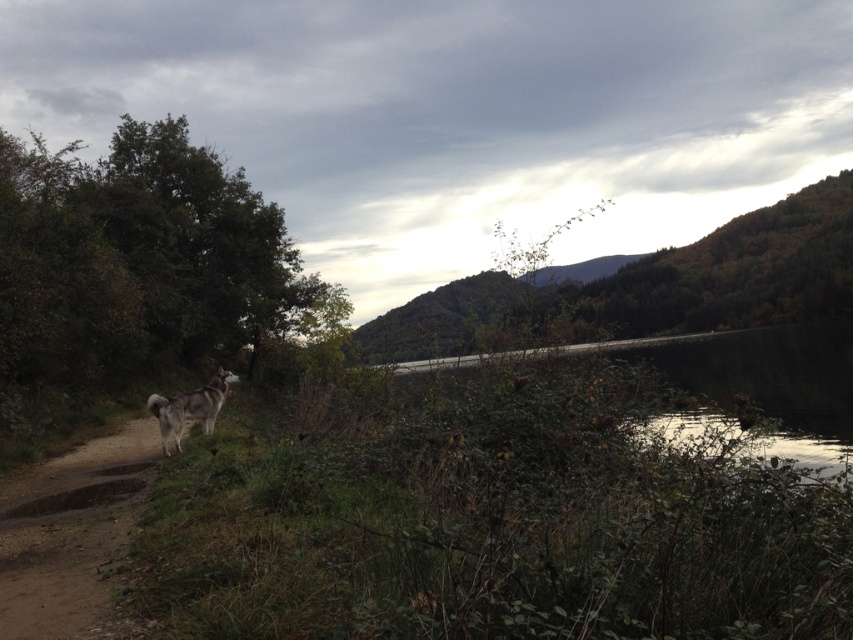
What is the exact coordinate of the dirt path at left?

The dirt path at left is located at coordinate point (70, 534).

You are standing at the starting point of the dirt path in the scene. There is a hidden treasure located at point (44, 556). If you walk straight ahead along the path, will you reach the treasure within 6 meters?

The distance of point (44, 556) from viewer is 6.32 meters, so walking straight ahead along the path will not reach the treasure within 6 meters since it is slightly farther than 6 meters.